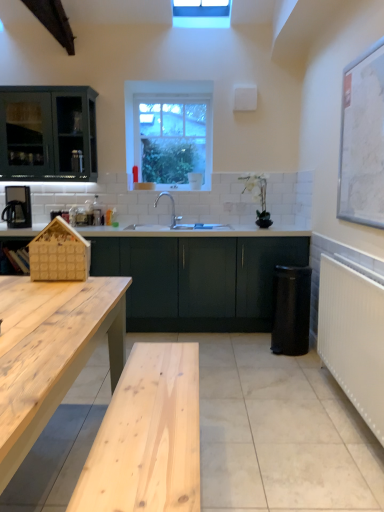
At what (x,y) coordinates should I click in order to perform the action: click on matte black kettle at left. Please return your answer as a coordinate pair (x, y). Looking at the image, I should click on (17, 207).

Find the location of a particular element. This screenshot has width=384, height=512. clear glass window at upper center is located at coordinates (170, 132).

Locate an element on the screen. The width and height of the screenshot is (384, 512). matte black kettle at left is located at coordinates (17, 207).

In the scene shown: Is matte black kettle at left located outside wooden house at left?

Yes, matte black kettle at left is outside of wooden house at left.

Considering the sizes of objects matte black kettle at left and wooden house at left in the image provided, who is bigger, matte black kettle at left or wooden house at left?

matte black kettle at left is bigger.

Is point (6, 189) closer or farther from the camera than point (44, 259)?

Point (6, 189) is positioned farther from the camera compared to point (44, 259).

Measure the distance between matte black kettle at left and wooden house at left.

The distance of matte black kettle at left from wooden house at left is 5.71 feet.

Is wooden house at left next to matte black kettle at left?

No, wooden house at left is not with matte black kettle at left.

Consider the image. Is wooden house at left bigger or smaller than matte black kettle at left?

Considering their sizes, wooden house at left takes up less space than matte black kettle at left.

Find the location of a particular element. This screenshot has height=512, width=384. crate in front of the matte black kettle at left is located at coordinates (59, 253).

Considering the positions of objects wooden house at left and matte black kettle at left in the image provided, who is more to the right, wooden house at left or matte black kettle at left?

From the viewer's perspective, wooden house at left appears more on the right side.

Is point (372, 315) closer or farther from the camera than point (159, 154)?

Point (372, 315) is closer to the camera than point (159, 154).

Between white textured radiator at right and clear glass window at upper center, which one appears on the left side from the viewer's perspective?

Positioned to the left is clear glass window at upper center.

From the image's perspective, is white textured radiator at right above or below clear glass window at upper center?

Based on their image positions, white textured radiator at right is located beneath clear glass window at upper center.

Is white textured radiator at right further to camera compared to clear glass window at upper center?

No, white textured radiator at right is in front of clear glass window at upper center.

From a real-world perspective, between matte black kettle at left and clear glass window at upper center, who is vertically higher?

In real-world perspective, clear glass window at upper center is above.

Which of these two, matte black kettle at left or clear glass window at upper center, is smaller?

matte black kettle at left.

Is matte black kettle at left positioned with its back to clear glass window at upper center?

No, matte black kettle at left is not facing away from clear glass window at upper center.

Would you say matte black kettle at left is to the left or to the right of clear glass window at upper center in the picture?

Clearly, matte black kettle at left is on the left of clear glass window at upper center in the image.

Is matte green cabinet at center looking in the opposite direction of matte black kettle at left?

That's not correct — matte green cabinet at center is not looking away from matte black kettle at left.

Consider the image. Which is more to the left, matte green cabinet at center or matte black kettle at left?

Positioned to the left is matte black kettle at left.

Is matte green cabinet at center next to matte black kettle at left?

No, matte green cabinet at center is not making contact with matte black kettle at left.

Is natural wood table at left facing away from clear glass window at upper center?

That's not correct — natural wood table at left is not looking away from clear glass window at upper center.

From the image's perspective, would you say natural wood table at left is shown under clear glass window at upper center?

Indeed, from the image's perspective, natural wood table at left is shown beneath clear glass window at upper center.

Which is closer to the camera, (59,316) or (143,140)?

Point (59,316).

Based on their sizes in the image, would you say white textured radiator at right is bigger or smaller than white matte map at upper right?

In the image, white textured radiator at right appears to be larger than white matte map at upper right.

Is white textured radiator at right shorter than white matte map at upper right?

Yes, white textured radiator at right is shorter than white matte map at upper right.

Is white textured radiator at right facing towards white matte map at upper right?

No, white textured radiator at right does not turn towards white matte map at upper right.

Locate an element on the screen. The image size is (384, 512). crate that appears on the right of matte black kettle at left is located at coordinates (59, 253).

You are a GUI agent. You are given a task and a screenshot of the screen. Output one action in this format:
    pyautogui.click(x=<x>, y=<y>)
    Task: Click on the crate located underneath the matte black kettle at left (from a real-world perspective)
    This screenshot has height=512, width=384.
    Given the screenshot: What is the action you would take?
    pyautogui.click(x=59, y=253)

Based on their spatial positions, is white ceramic sink at center or clear glass window at upper center closer to wooden house at left?

Among the two, white ceramic sink at center is located nearer to wooden house at left.

Looking at this image, when comparing their distances from clear glass window at upper center, does matte black kettle at left or white textured radiator at right seem closer?

Among the two, matte black kettle at left is located nearer to clear glass window at upper center.

When comparing their distances from white matte map at upper right, does natural wood table at left or white ceramic sink at center seem closer?

natural wood table at left.

Estimate the real-world distances between objects in this image. Which object is closer to wooden house at left, white ceramic sink at center or white textured radiator at right?

white textured radiator at right.

In the scene shown: Estimate the real-world distances between objects in this image. Which object is closer to white matte map at upper right, matte black kettle at left or white ceramic sink at center?

The object closer to white matte map at upper right is white ceramic sink at center.

Looking at this image, when comparing their distances from white textured radiator at right, does white ceramic sink at center or natural wood table at left seem further?

white ceramic sink at center lies further to white textured radiator at right than the other object.

Which object lies further to the anchor point white textured radiator at right, white matte map at upper right or matte black kettle at left?

Based on the image, matte black kettle at left appears to be further to white textured radiator at right.

When comparing their distances from wooden house at left, does white ceramic sink at center or matte black kettle at left seem further?

white ceramic sink at center is positioned further to the anchor wooden house at left.

Locate an element on the screen. crate positioned between white matte map at upper right and clear glass window at upper center from near to far is located at coordinates click(x=59, y=253).

Identify the location of cabinetry positioned between wooden house at left and clear glass window at upper center from near to far. click(x=198, y=279).

The image size is (384, 512). I want to click on crate between white textured radiator at right and matte green cabinet at center in the front-back direction, so click(59, 253).

Find the location of `radiator situated between natural wood table at left and white matte map at upper right from left to right`. radiator situated between natural wood table at left and white matte map at upper right from left to right is located at coordinates (353, 335).